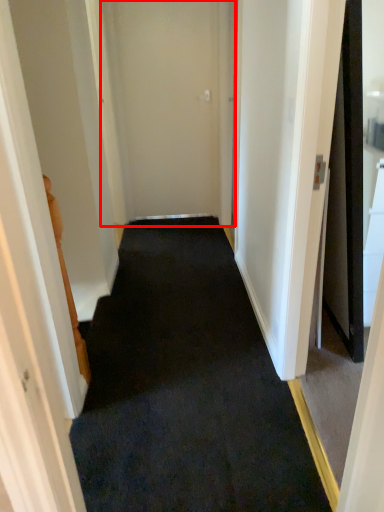
Question: From the image's perspective, considering the relative positions of door (annotated by the red box) and doormat in the image provided, where is door (annotated by the red box) located with respect to the staircase?

Choices:
 (A) above
 (B) below

Answer: (A)